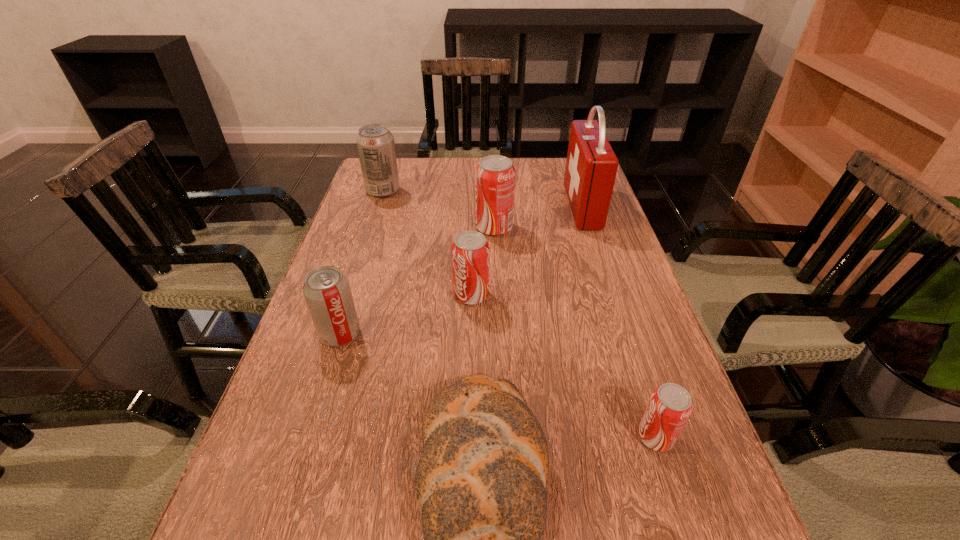
I want to click on object identified as the fifth closest to the third nearest object, so click(670, 405).

Identify which soda can is the fourth closest to the second nearest red soda can. Please provide its 2D coordinates. Your answer should be formatted as a tuple, i.e. [(x, y)], where the tuple contains the x and y coordinates of a point satisfying the conditions above.

[(375, 143)]

Locate which soda can ranks fourth in proximity to the nearer gray soda can. Please provide its 2D coordinates. Your answer should be formatted as a tuple, i.e. [(x, y)], where the tuple contains the x and y coordinates of a point satisfying the conditions above.

[(670, 405)]

Identify which red soda can is located as the second nearest to the third farthest soda can. Please provide its 2D coordinates. Your answer should be formatted as a tuple, i.e. [(x, y)], where the tuple contains the x and y coordinates of a point satisfying the conditions above.

[(670, 405)]

Identify which red soda can is located as the second nearest to the rightmost soda can. Please provide its 2D coordinates. Your answer should be formatted as a tuple, i.e. [(x, y)], where the tuple contains the x and y coordinates of a point satisfying the conditions above.

[(495, 175)]

At what (x,y) coordinates should I click in order to perform the action: click on the closest gray soda can to the shortest soda can. Please return your answer as a coordinate pair (x, y). Looking at the image, I should click on (326, 289).

Identify the location of free location that satisfies the following two spatial constraints: 1. on the logo side of the farthest red soda can; 2. on the front side of the smaller gray soda can. (498, 334).